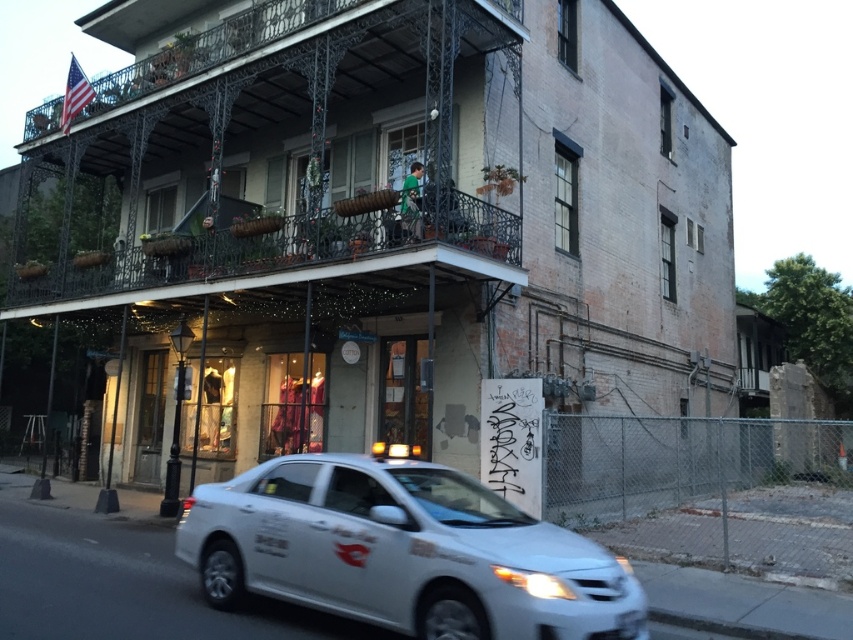
Question: Which point is closer to the camera taking this photo?

Choices:
 (A) (434, 541)
 (B) (492, 209)

Answer: (A)

Question: Which point is closer to the camera?

Choices:
 (A) black wrought iron balcony at upper center
 (B) white matte car at lower center

Answer: (B)

Question: Can you confirm if black wrought iron balcony at upper center is bigger than white matte car at lower center?

Choices:
 (A) no
 (B) yes

Answer: (B)

Question: Is black wrought iron balcony at upper center above white matte car at lower center?

Choices:
 (A) no
 (B) yes

Answer: (B)

Question: Is black wrought iron balcony at upper center bigger than white matte car at lower center?

Choices:
 (A) no
 (B) yes

Answer: (B)

Question: Which point is farther to the camera?

Choices:
 (A) white matte car at lower center
 (B) black wrought iron balcony at upper center

Answer: (B)